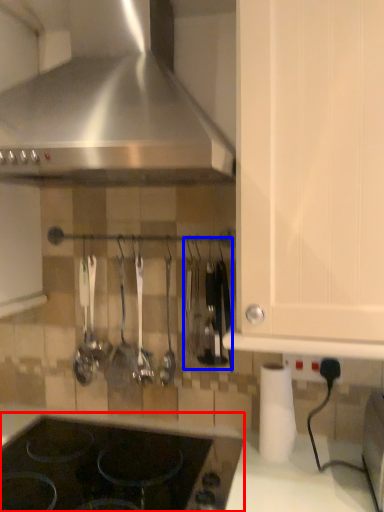
Question: Which object is closer to the camera taking this photo, gas stove (highlighted by a red box) or cutlery (highlighted by a blue box)?

Choices:
 (A) gas stove
 (B) cutlery

Answer: (A)